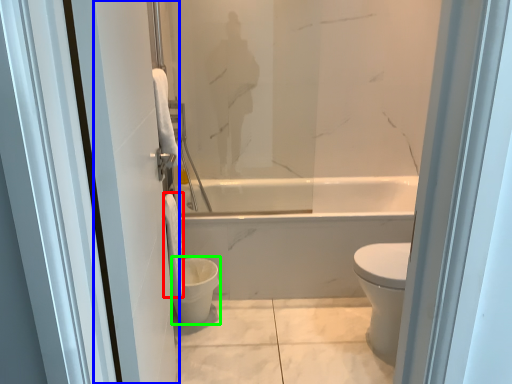
Question: Estimate the real-world distances between objects in this image. Which object is farther from toilet paper (highlighted by a red box), screen door (highlighted by a blue box) or toilet bowl (highlighted by a green box)?

Choices:
 (A) screen door
 (B) toilet bowl

Answer: (A)